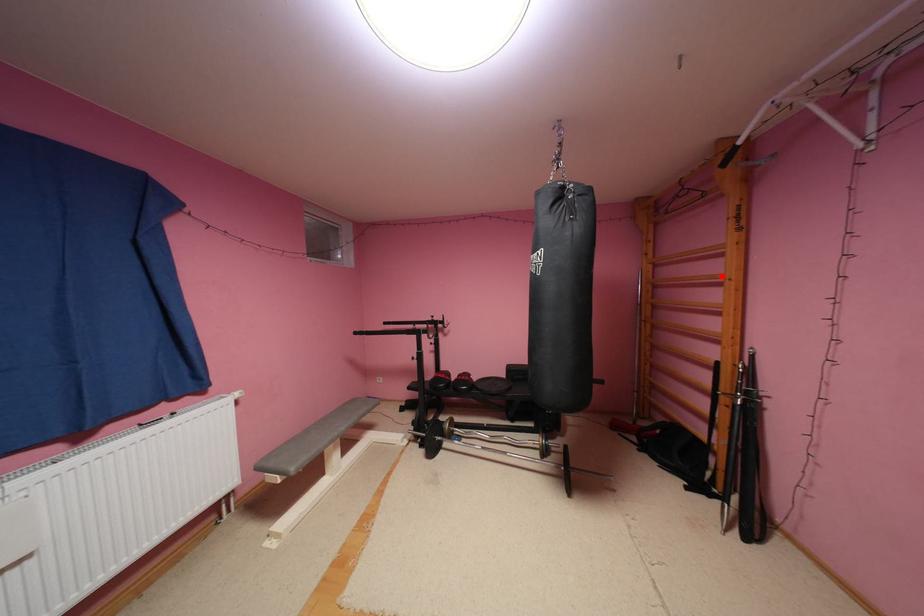
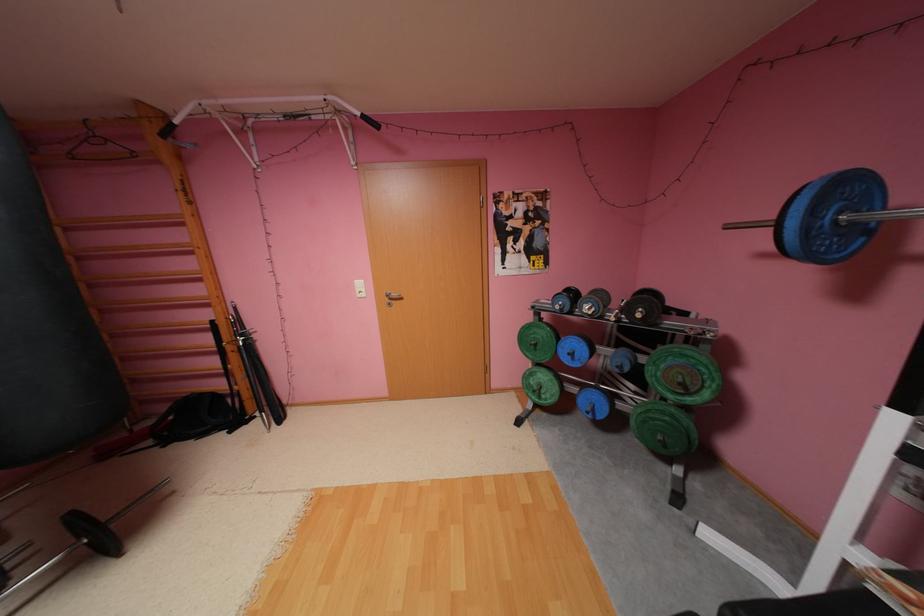
Question: I am providing you with two images of the same scene from different viewpoints. A red point is marked on the first image. Is the red point's position out of view in image 2?

Choices:
 (A) Yes
 (B) No

Answer: (B)